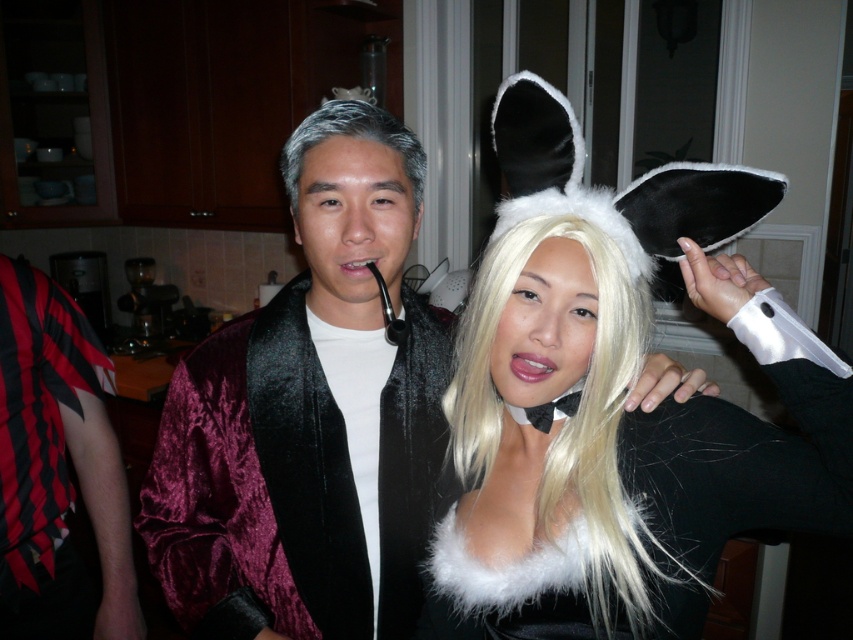
Is velvet burgundy jacket at center bigger than matte black pipe at center?

Yes.

At what (x,y) coordinates should I click in order to perform the action: click on velvet burgundy jacket at center. Please return your answer as a coordinate pair (x, y). This screenshot has width=853, height=640. Looking at the image, I should click on (306, 419).

The height and width of the screenshot is (640, 853). I want to click on velvet burgundy jacket at center, so click(x=306, y=419).

Find the location of a particular element. velvet burgundy jacket at center is located at coordinates (306, 419).

The height and width of the screenshot is (640, 853). What do you see at coordinates (531, 365) in the screenshot? I see `glossy matte lips at center` at bounding box center [531, 365].

Is glossy matte lips at center further to camera compared to matte black pipe at center?

No, glossy matte lips at center is closer to the viewer.

Between point (527, 355) and point (347, 259), which one is positioned behind?

Point (347, 259)

The image size is (853, 640). What are the coordinates of `glossy matte lips at center` in the screenshot? It's located at (531, 365).

Does point (343, 106) come in front of point (347, 269)?

No, (343, 106) is behind (347, 269).

Which is in front, point (422, 154) or point (361, 266)?

Point (361, 266) is in front.

Who is more distant from viewer, (303, 141) or (346, 269)?

The point (303, 141) is behind.

Find the location of a particular element. gray velvety wig at center is located at coordinates (x=352, y=136).